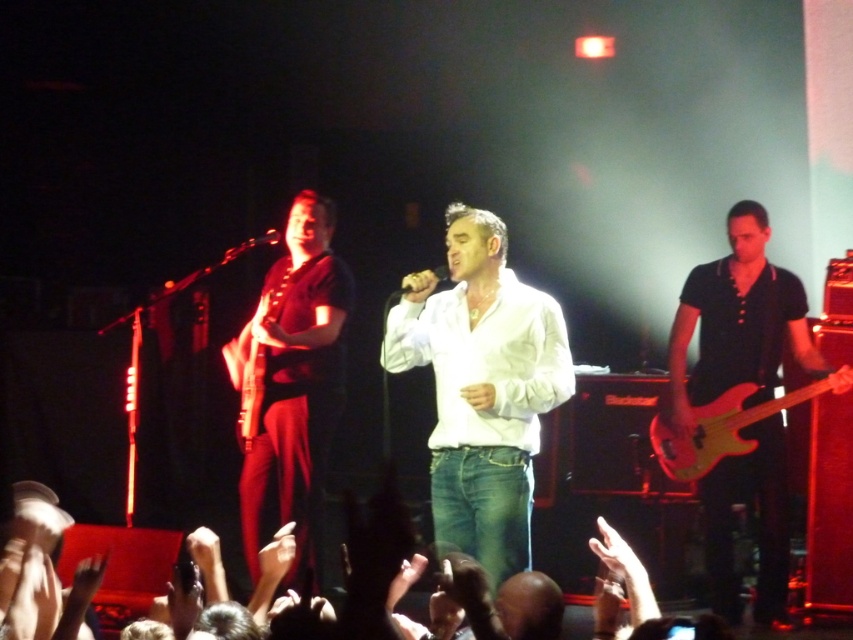
You are a photographer at the concert venue. You need to take a photo of the matte black guitar at left and the matte red electric bass at right. Which one should you focus on first to ensure both are in sharp focus?

You should focus on the matte black guitar at left first because it is closer to you than the matte red electric bass at right, so adjusting focus from near to far will help both be in sharp focus.

You are a stagehand who needs to place a new stand for the matte black guitar at left and the wooden electric guitar at center. Given their sizes, which guitar requires a wider stand?

The matte black guitar at left requires a wider stand because its width is larger than the wooden electric guitar at center.

You are a stagehand needing to stack the matte black guitar at left and the wooden electric guitar at center vertically. Based on their sizes, which one should you place at the bottom to ensure stability?

The matte black guitar at left is much taller than the wooden electric guitar at center, so placing the taller matte black guitar at left at the bottom would provide better stability due to its height and lower center of gravity.